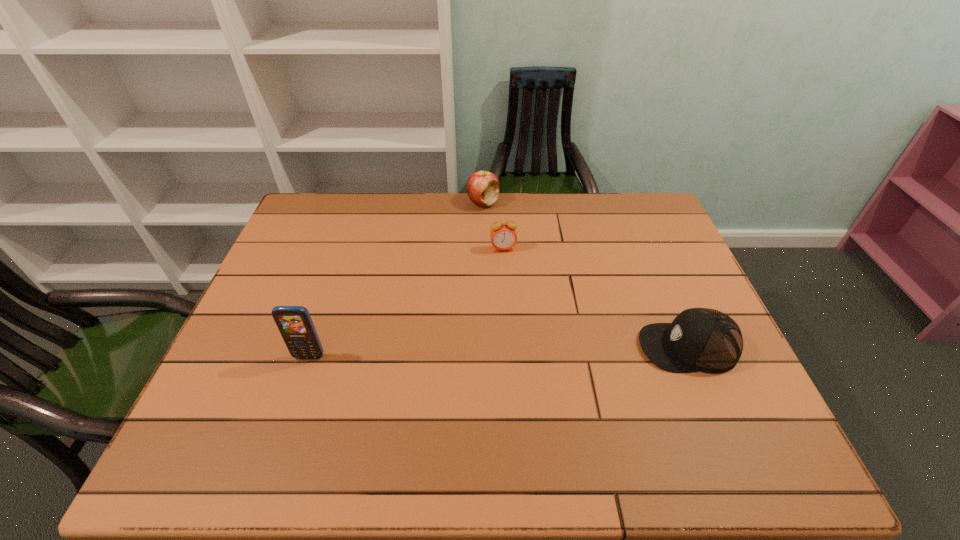
Image resolution: width=960 pixels, height=540 pixels. I want to click on vacant spot on the desktop that is between the leftmost object and the rightmost object and is positioned on the face of the alarm clock, so click(x=522, y=351).

Locate an element on the screen. free space on the desktop that is between the tallest object and the rightmost object and is positioned on the bitten side of the apple is located at coordinates (486, 352).